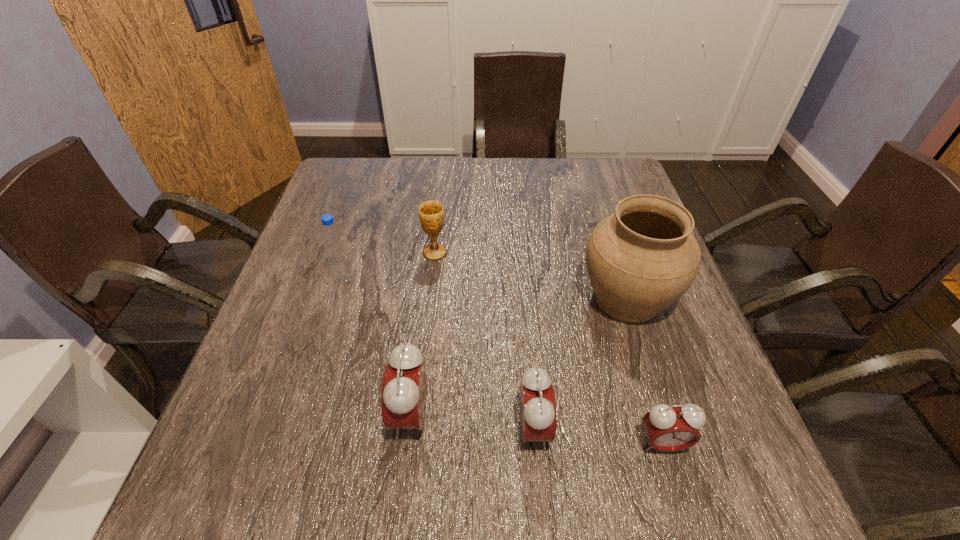
Observe the arrangement of all alarm clocks in the image. To keep them evenly spaced, where would you place another alarm clock on the left? Please locate a free space. Please provide its 2D coordinates. Your answer should be formatted as a tuple, i.e. [(x, y)], where the tuple contains the x and y coordinates of a point satisfying the conditions above.

[(294, 402)]